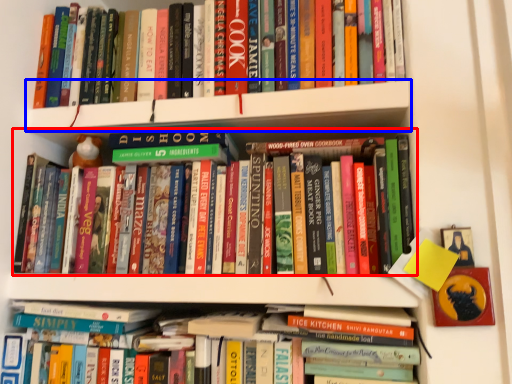
Question: Which object is closer to the camera taking this photo, book (highlighted by a red box) or shelf (highlighted by a blue box)?

Choices:
 (A) book
 (B) shelf

Answer: (A)